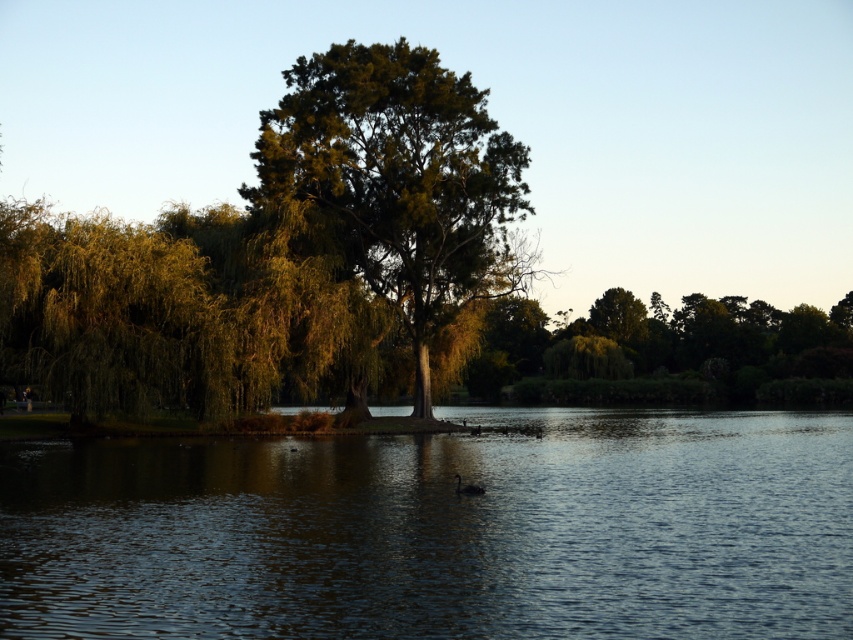
Question: Among these objects, which one is farthest from the camera?

Choices:
 (A) dark reflective water at center
 (B) green leafy tree at center
 (C) black matte duck at center

Answer: (B)

Question: Can you confirm if green leafy tree at center is thinner than black matte duck at center?

Choices:
 (A) no
 (B) yes

Answer: (A)

Question: Is green leafy tree at center positioned behind black matte duck at center?

Choices:
 (A) yes
 (B) no

Answer: (A)

Question: Which object is positioned farthest from the green leafy tree at center?

Choices:
 (A) dark reflective water at center
 (B) black matte duck at center

Answer: (B)

Question: Which point appears farthest from the camera in this image?

Choices:
 (A) (431, 161)
 (B) (471, 486)

Answer: (A)

Question: Is dark reflective water at center bigger than black matte duck at center?

Choices:
 (A) no
 (B) yes

Answer: (B)